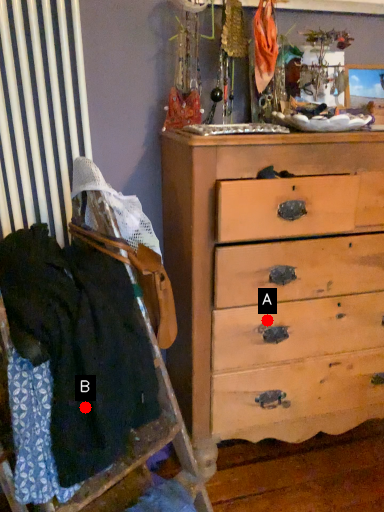
Question: Two points are circled on the image, labeled by A and B beside each circle. Which point appears farthest from the camera in this image?

Choices:
 (A) A is further
 (B) B is further

Answer: (A)